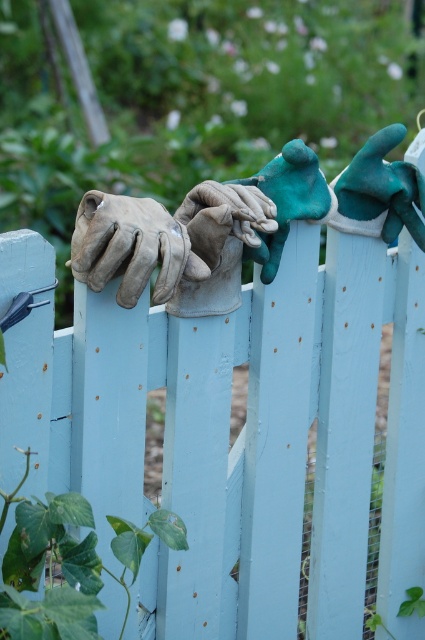
You are standing in a garden and want to place a small potted plant exactly where the point at point (99, 259) is located. The plant is 3 feet tall. Can you determine if the plant will fit without being too close to the camera?

The point at point (99, 259) is 5.62 feet away from the camera. Since the plant is 3 feet tall, it will fit at that location as it is not too close to the camera.

You have two pairs of gloves on the fence. The green fabric glove at upper right and the green matte glove at center. Which one is wider?

The green matte glove at center is wider than the green fabric glove at upper right.